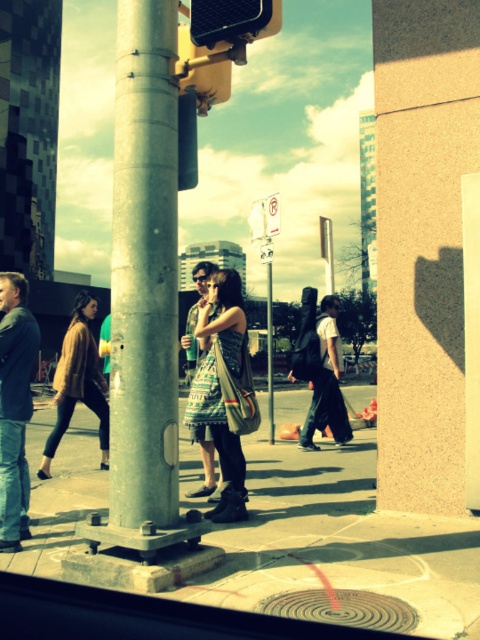
You are standing on the sidewalk and see a patterned fabric dress at center and a smooth concrete sidewalk at center. Which object is closer to your left side?

The patterned fabric dress at center is closer to your left side since the smooth concrete sidewalk at center is positioned to its right.

You are standing on the smooth concrete sidewalk at center and want to see the patterned fabric dress at center. Which direction should you look to see it?

The smooth concrete sidewalk at center is in front of the patterned fabric dress at center, so you should look behind you to see the patterned fabric dress at center.